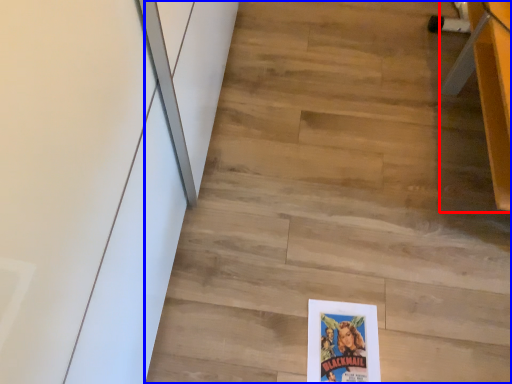
Question: Among these objects, which one is farthest to the camera, furniture (highlighted by a red box) or stair (highlighted by a blue box)?

Choices:
 (A) furniture
 (B) stair

Answer: (B)